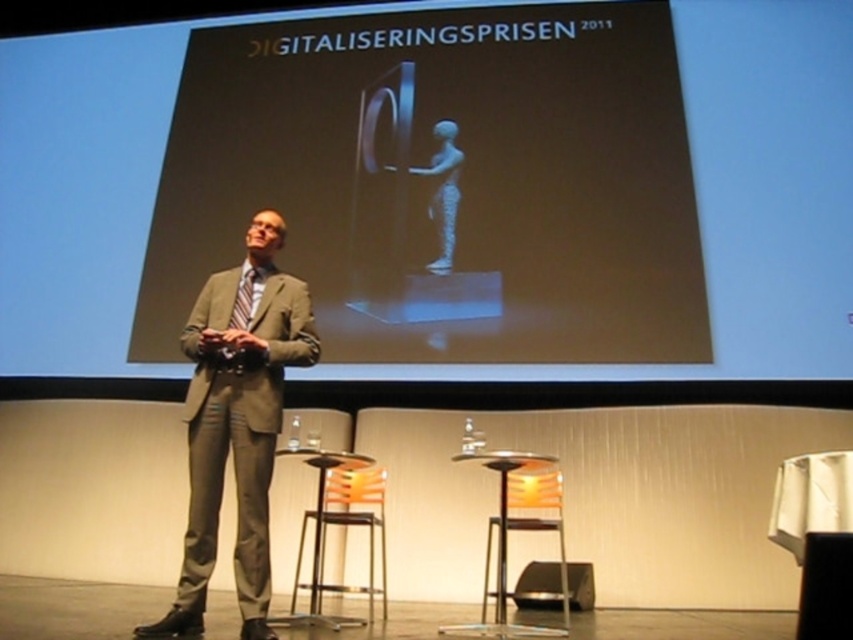
Question: Which object is the closest to the striped fabric tie at center?

Choices:
 (A) orange fabric stool at lower center
 (B) matte black suit at center
 (C) matte gray suit at center
 (D) orange plastic chair at center

Answer: (C)

Question: Can you confirm if matte gray suit at center is positioned above orange plastic chair at center?

Choices:
 (A) no
 (B) yes

Answer: (B)

Question: Does matte black screen at upper center appear on the left side of striped fabric tie at center?

Choices:
 (A) yes
 (B) no

Answer: (B)

Question: Which point appears farthest from the camera in this image?

Choices:
 (A) (235, 326)
 (B) (679, 36)

Answer: (B)

Question: Among these objects, which one is farthest from the camera?

Choices:
 (A) orange plastic chair at center
 (B) matte black screen at upper center
 (C) matte black suit at center
 (D) striped fabric tie at center

Answer: (B)

Question: Does matte gray suit at center have a larger size compared to striped fabric tie at center?

Choices:
 (A) yes
 (B) no

Answer: (A)